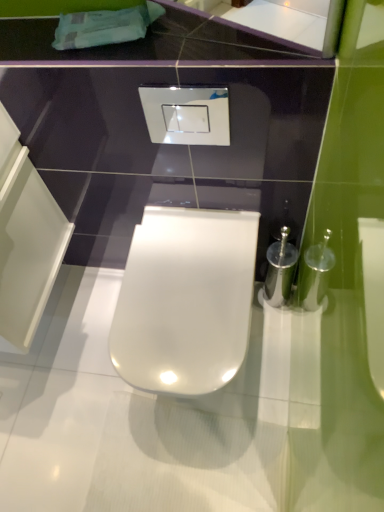
Locate an element on the screen. Image resolution: width=384 pixels, height=512 pixels. white glossy toilet at center is located at coordinates (185, 300).

Measure the distance between white glossy toilet at center and camera.

The distance of white glossy toilet at center from camera is 95.73 centimeters.

The image size is (384, 512). Describe the element at coordinates (185, 300) in the screenshot. I see `white glossy toilet at center` at that location.

The width and height of the screenshot is (384, 512). I want to click on white glossy toilet at center, so click(x=185, y=300).